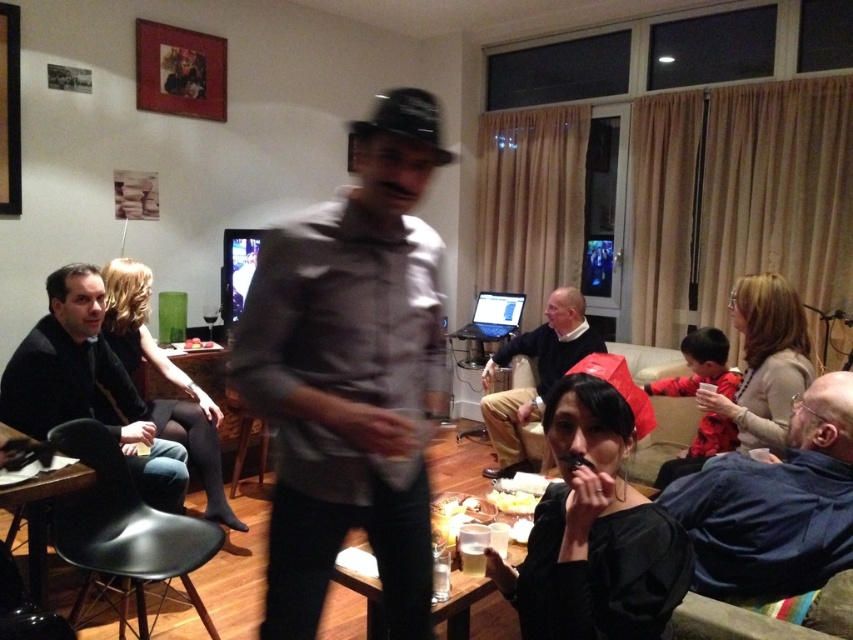
You are organizing a clothing display and need to arrange the blue denim shirt at lower right and the smooth black shirt at center based on their sizes. Which shirt should you place first if you want to start with the smaller one?

The blue denim shirt at lower right is smaller than the smooth black shirt at center, so you should place the blue denim shirt at lower right first.

You are organizing a clothing display and need to place the gray matte shirt at center and the blue denim shirt at lower right on a rack. Based on their sizes, which shirt should be placed on the higher rack to ensure visibility?

The gray matte shirt at center has a lesser width compared to the blue denim shirt at lower right, so placing the smaller gray matte shirt at center on the higher rack will ensure better visibility while keeping the wider blue denim shirt at lower right on the lower rack.